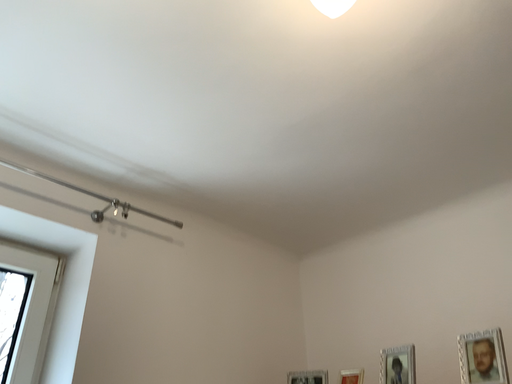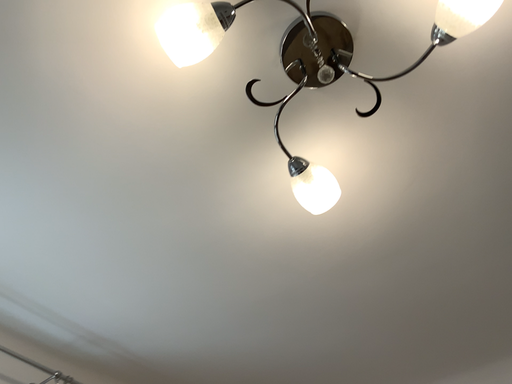
Question: How did the camera likely rotate when shooting the video?

Choices:
 (A) rotated downward
 (B) rotated upward

Answer: (B)